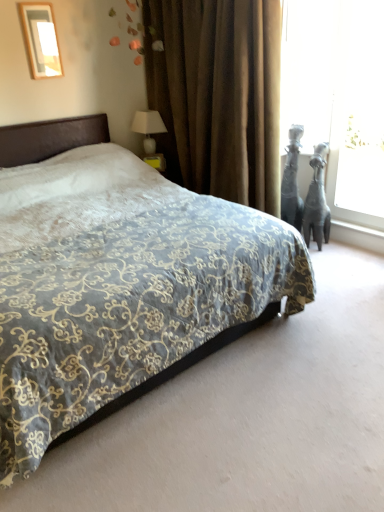
At what (x,y) coordinates should I click in order to perform the action: click on vacant region in front of matte black giraffe at right. Please return your answer as a coordinate pair (x, y). The width and height of the screenshot is (384, 512). Looking at the image, I should click on (332, 257).